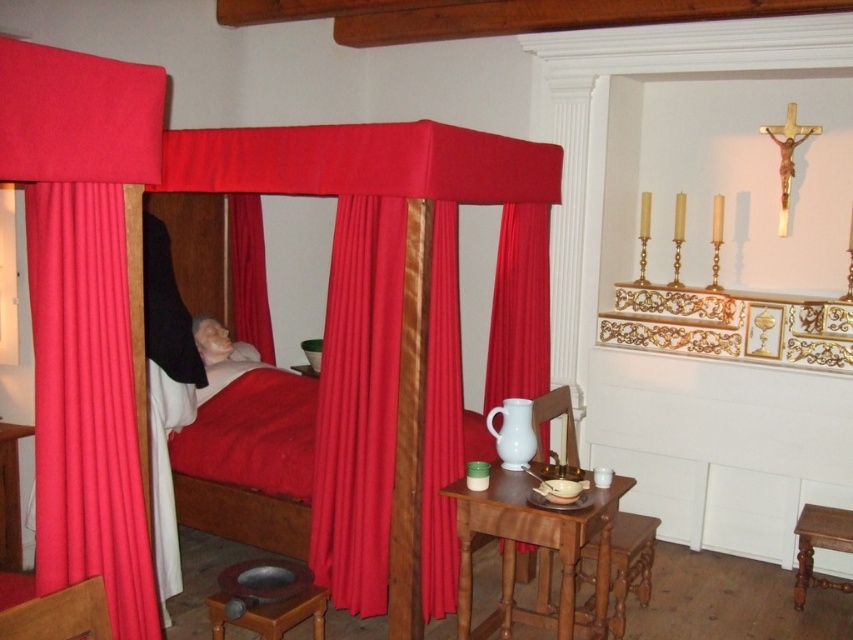
You are standing in the room and want to sit down. Which chair, the wooden chair at lower left or the white wood chair at center, is closer to your current position?

The wooden chair at lower left is closer to your current position because it is positioned below the white wood chair at center, meaning it is nearer to the observer.

You are standing in the room and want to sit on the closest chair to you. Which chair should you choose between the wooden chair at lower left and the white wood chair at center?

The wooden chair at lower left is closer to the viewer than the white wood chair at center, so you should choose the wooden chair at lower left to sit on.

You are a guest entering the room and need to sit down. Which object, the matte red curtain at left or the wooden carved stool at lower center, is a better option for seating?

The wooden carved stool at lower center is the better option for seating because the matte red curtain at left is taller but not designed for sitting.